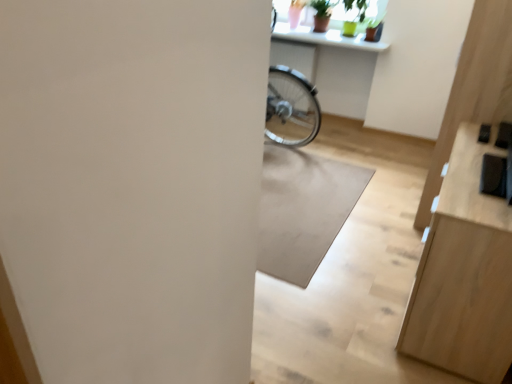
I want to click on blank space situated above white matte mat at center (from a real-world perspective), so click(303, 188).